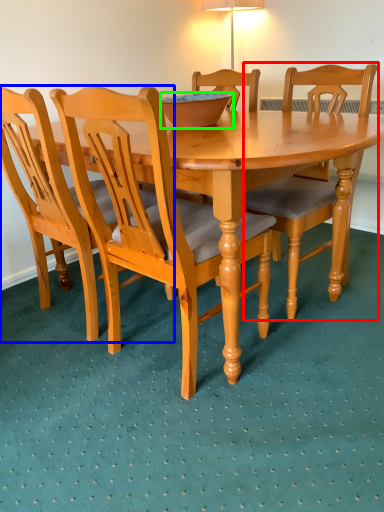
Question: Which object is positioned farthest from chair (highlighted by a red box)? Select from chair (highlighted by a blue box) and bowl (highlighted by a green box).

Choices:
 (A) chair
 (B) bowl

Answer: (A)